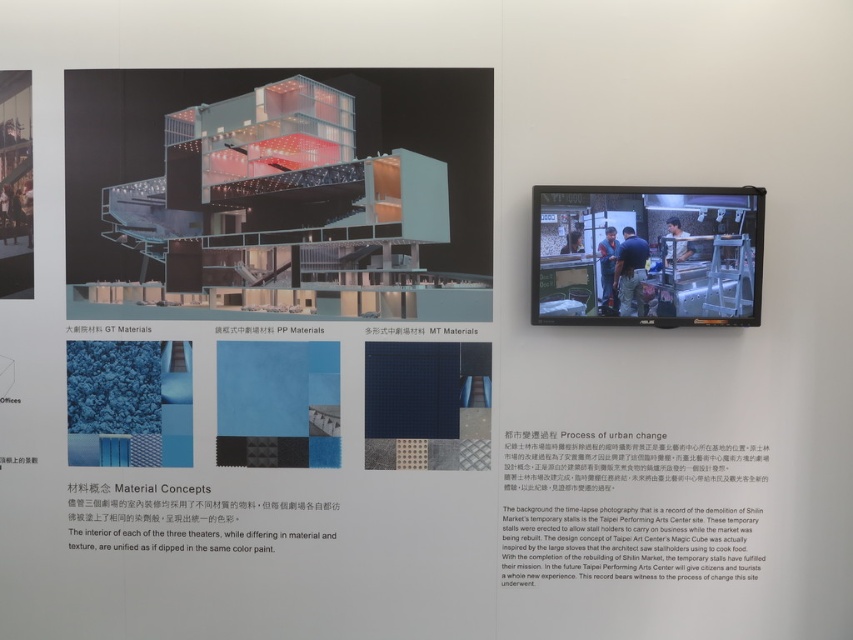
Consider the image. Does blue fabric shirt at upper center appear on the left side of blue fabric at upper center?

In fact, blue fabric shirt at upper center is to the right of blue fabric at upper center.

Does blue fabric shirt at upper center have a greater width compared to blue fabric at upper center?

Yes.

What do you see at coordinates (676, 241) in the screenshot?
I see `blue fabric shirt at upper center` at bounding box center [676, 241].

Identify the location of blue fabric shirt at upper center. (676, 241).

Between blue jeans at center and blue fabric at upper center, which one is positioned lower?

blue jeans at center is below.

Is point (628, 268) in front of point (576, 252)?

Yes, it is in front of point (576, 252).

Identify the location of blue jeans at center. (630, 272).

Between point (637, 276) and point (614, 305), which one is positioned behind?

The point (614, 305) is more distant.

Is blue jeans at center thinner than blue uniform at center?

Incorrect, blue jeans at center's width is not less than blue uniform at center's.

Find the location of `blue jeans at center`. blue jeans at center is located at coordinates (630, 272).